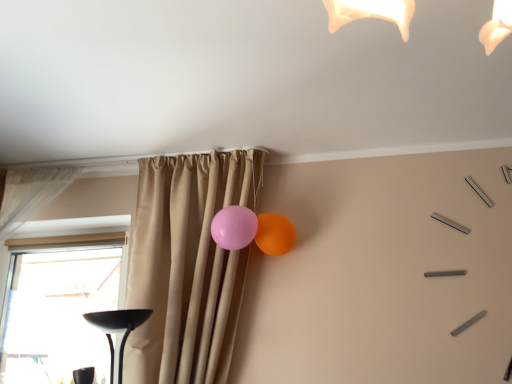
Question: Is pink rubber balloon at center, the first balloon when ordered from left to right, directly adjacent to matte rubber balloon at upper right, which appears as the 2th balloon when viewed from the left?

Choices:
 (A) no
 (B) yes

Answer: (A)

Question: Is pink rubber balloon at center, the 2th balloon positioned from the right, taller than matte rubber balloon at upper right, positioned as the 1th balloon in right-to-left order?

Choices:
 (A) no
 (B) yes

Answer: (A)

Question: Does pink rubber balloon at center, the 2th balloon positioned from the right, lie behind matte rubber balloon at upper right, positioned as the 1th balloon in right-to-left order?

Choices:
 (A) no
 (B) yes

Answer: (A)

Question: Would you say pink rubber balloon at center, the 2th balloon positioned from the right, contains matte rubber balloon at upper right, positioned as the 1th balloon in right-to-left order?

Choices:
 (A) yes
 (B) no

Answer: (B)

Question: Is the position of pink rubber balloon at center, the first balloon when ordered from left to right, less distant than that of matte rubber balloon at upper right, positioned as the 1th balloon in right-to-left order?

Choices:
 (A) no
 (B) yes

Answer: (B)

Question: Can you confirm if pink rubber balloon at center, the 2th balloon positioned from the right, is positioned to the right of matte rubber balloon at upper right, which appears as the 2th balloon when viewed from the left?

Choices:
 (A) yes
 (B) no

Answer: (B)

Question: Does transparent glass window at lower left have a smaller size compared to matte rubber balloon at upper right, which appears as the 2th balloon when viewed from the left?

Choices:
 (A) no
 (B) yes

Answer: (A)

Question: Is there a large distance between transparent glass window at lower left and matte rubber balloon at upper right, which appears as the 2th balloon when viewed from the left?

Choices:
 (A) no
 (B) yes

Answer: (B)

Question: Considering the relative sizes of transparent glass window at lower left and matte rubber balloon at upper right, positioned as the 1th balloon in right-to-left order, in the image provided, is transparent glass window at lower left shorter than matte rubber balloon at upper right, positioned as the 1th balloon in right-to-left order,?

Choices:
 (A) no
 (B) yes

Answer: (A)

Question: From a real-world perspective, is transparent glass window at lower left physically below matte rubber balloon at upper right, positioned as the 1th balloon in right-to-left order?

Choices:
 (A) no
 (B) yes

Answer: (B)

Question: Is transparent glass window at lower left to the left of matte rubber balloon at upper right, positioned as the 1th balloon in right-to-left order, from the viewer's perspective?

Choices:
 (A) yes
 (B) no

Answer: (A)

Question: Considering the relative sizes of transparent glass window at lower left and matte rubber balloon at upper right, positioned as the 1th balloon in right-to-left order, in the image provided, is transparent glass window at lower left taller than matte rubber balloon at upper right, positioned as the 1th balloon in right-to-left order,?

Choices:
 (A) yes
 (B) no

Answer: (A)

Question: Is pink rubber balloon at center, the 2th balloon positioned from the right, at the right side of white sheer curtain at left, arranged as the 2th curtain when viewed from the right?

Choices:
 (A) yes
 (B) no

Answer: (A)